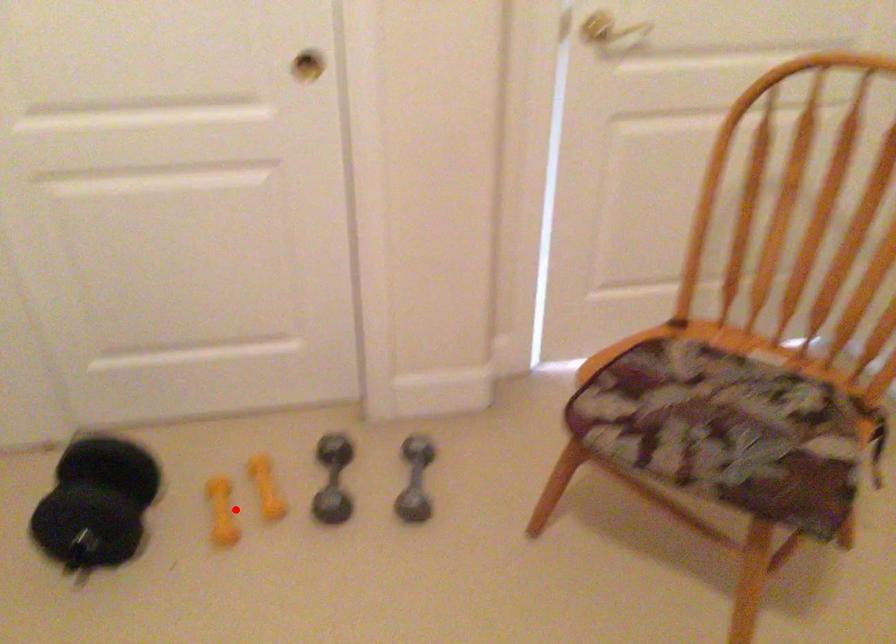
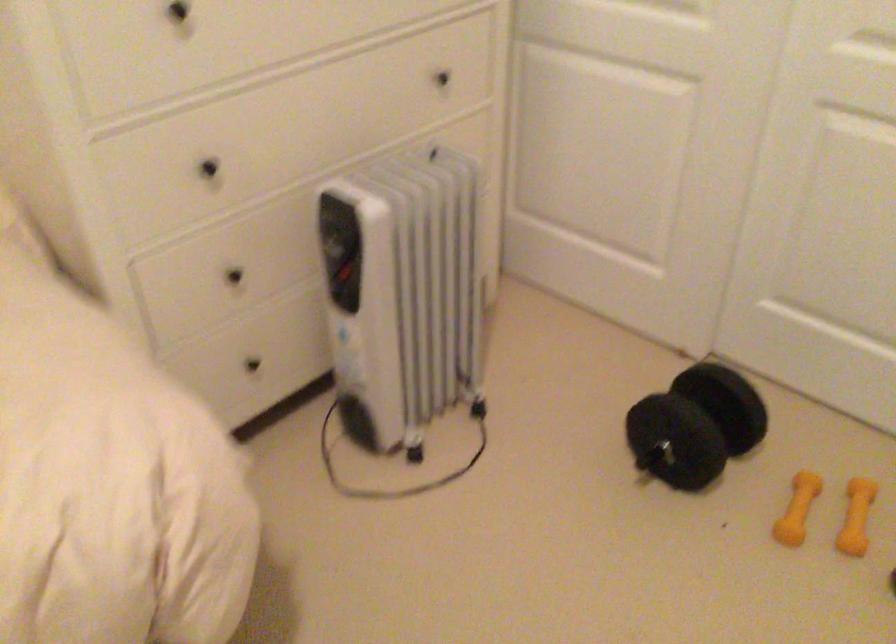
Question: I am providing you with two images of the same scene from different viewpoints. In image1, a red point is highlighted. Considering the same 3D point in image2, which of the following is correct?

Choices:
 (A) It is closer
 (B) It is farther

Answer: (A)